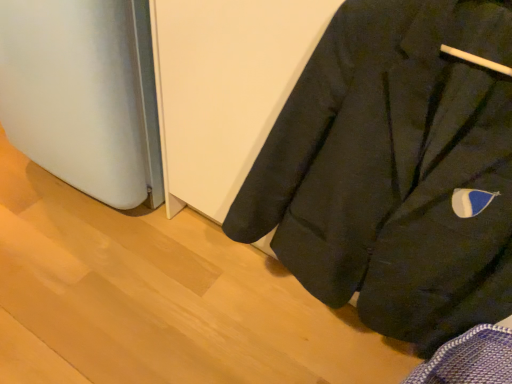
Question: Considering the relative positions of satin white refrigerator at lower left and black matte coat at lower right in the image provided, is satin white refrigerator at lower left to the left of black matte coat at lower right from the viewer's perspective?

Choices:
 (A) yes
 (B) no

Answer: (A)

Question: Could you tell me if satin white refrigerator at lower left is turned towards black matte coat at lower right?

Choices:
 (A) yes
 (B) no

Answer: (B)

Question: Is satin white refrigerator at lower left thinner than black matte coat at lower right?

Choices:
 (A) yes
 (B) no

Answer: (B)

Question: Is satin white refrigerator at lower left closer to camera compared to black matte coat at lower right?

Choices:
 (A) no
 (B) yes

Answer: (A)

Question: From a real-world perspective, is satin white refrigerator at lower left positioned over black matte coat at lower right based on gravity?

Choices:
 (A) yes
 (B) no

Answer: (B)

Question: Can you see satin white refrigerator at lower left touching black matte coat at lower right?

Choices:
 (A) yes
 (B) no

Answer: (B)

Question: Can you confirm if black matte coat at lower right is smaller than satin white refrigerator at lower left?

Choices:
 (A) yes
 (B) no

Answer: (A)

Question: Does black matte coat at lower right appear on the left side of satin white refrigerator at lower left?

Choices:
 (A) no
 (B) yes

Answer: (A)

Question: From the image's perspective, is black matte coat at lower right located above satin white refrigerator at lower left?

Choices:
 (A) yes
 (B) no

Answer: (B)

Question: Can you confirm if black matte coat at lower right is taller than satin white refrigerator at lower left?

Choices:
 (A) yes
 (B) no

Answer: (A)

Question: Considering the relative positions of black matte coat at lower right and satin white refrigerator at lower left in the image provided, is black matte coat at lower right to the right of satin white refrigerator at lower left from the viewer's perspective?

Choices:
 (A) no
 (B) yes

Answer: (B)

Question: Is black matte coat at lower right thinner than satin white refrigerator at lower left?

Choices:
 (A) no
 (B) yes

Answer: (B)

Question: In terms of height, does satin white refrigerator at lower left look taller or shorter compared to black matte coat at lower right?

Choices:
 (A) tall
 (B) short

Answer: (B)